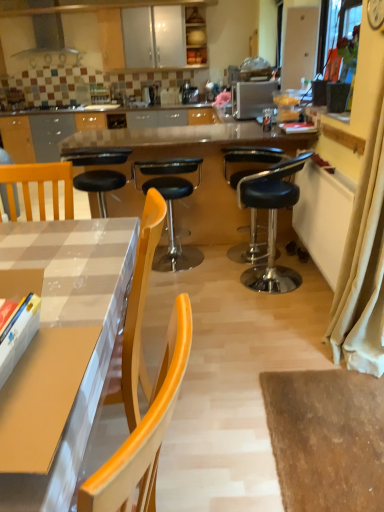
Question: Do you think white paper at center is within black leather stool at center, which is counted as the second chair, starting from the right, or outside of it?

Choices:
 (A) outside
 (B) inside

Answer: (A)

Question: Is white paper at center in front of or behind black leather stool at center, which is counted as the second chair, starting from the right, in the image?

Choices:
 (A) behind
 (B) front

Answer: (A)

Question: Considering the real-world distances, which object is farthest from the orange plastic chair at center, which is the third chair from right to left?

Choices:
 (A) white paper at center
 (B) wooden chair at left
 (C) white glossy table at center
 (D) metallic silver range hood at upper center
 (E) black leather stool at center, which is counted as the second chair, starting from the right

Answer: (D)

Question: Which object is positioned farthest from the white glossy table at lower left?

Choices:
 (A) orange plastic chair at center, which is the third chair from right to left
 (B) wooden chair at left
 (C) metallic silver toaster at upper center
 (D) metallic silver range hood at upper center
 (E) white glossy table at center

Answer: (D)